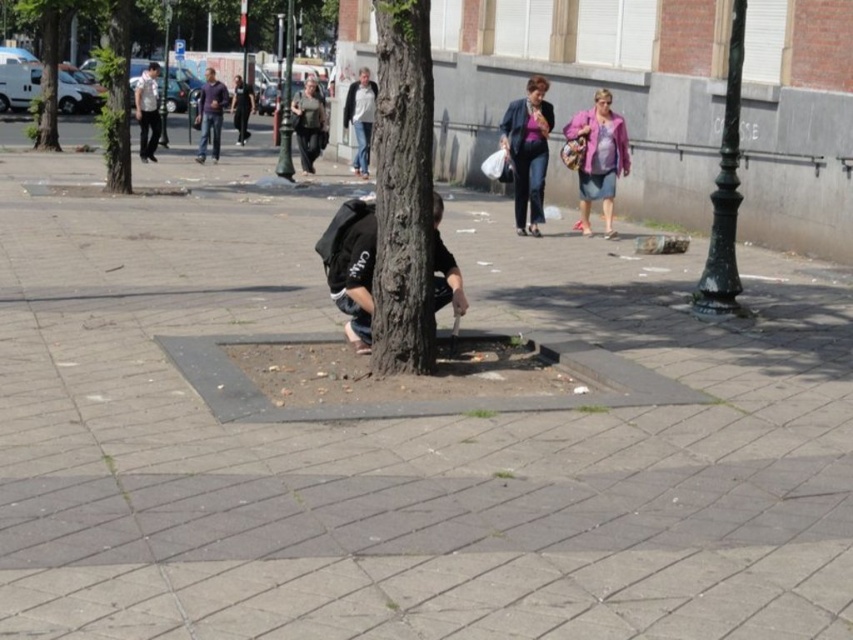
Question: Can you confirm if green rough bark tree at upper left is positioned above dark purple sweater at center?

Choices:
 (A) no
 (B) yes

Answer: (B)

Question: Which object is closer to the camera taking this photo?

Choices:
 (A) dark blue jeans at center
 (B) pink fabric jacket at upper right

Answer: (B)

Question: Can you confirm if dark brown textured tree trunk at center is positioned to the left of dark gray sweater at center?

Choices:
 (A) no
 (B) yes

Answer: (A)

Question: Which point is farther to the camera?

Choices:
 (A) dark gray sweater at center
 (B) white cotton sweater at center
 (C) black matte jacket at center

Answer: (A)

Question: In this image, where is pink fabric jacket at upper right located relative to smooth bark tree at upper left?

Choices:
 (A) below
 (B) above

Answer: (A)

Question: Among these objects, which one is nearest to the camera?

Choices:
 (A) white cotton sweater at center
 (B) green rough bark tree at upper left
 (C) purple matte jacket at upper right

Answer: (C)